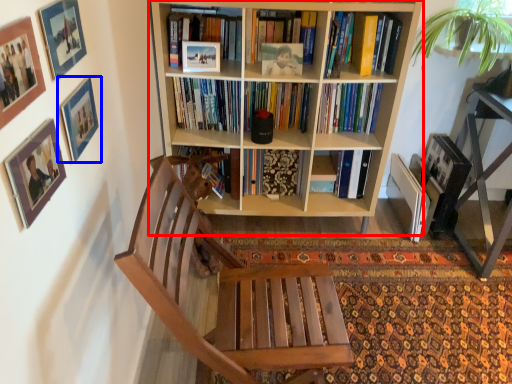
Question: Which of the following is the farthest to the observer, bookcase (highlighted by a red box) or picture frame (highlighted by a blue box)?

Choices:
 (A) bookcase
 (B) picture frame

Answer: (A)